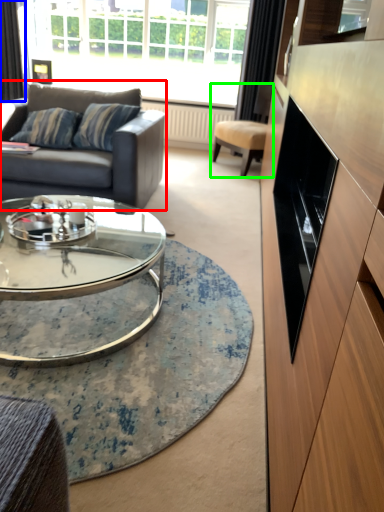
Question: Which object is the closest to the studio couch (highlighted by a red box)? Choose among these: curtain (highlighted by a blue box) or chair (highlighted by a green box).

Choices:
 (A) curtain
 (B) chair

Answer: (B)